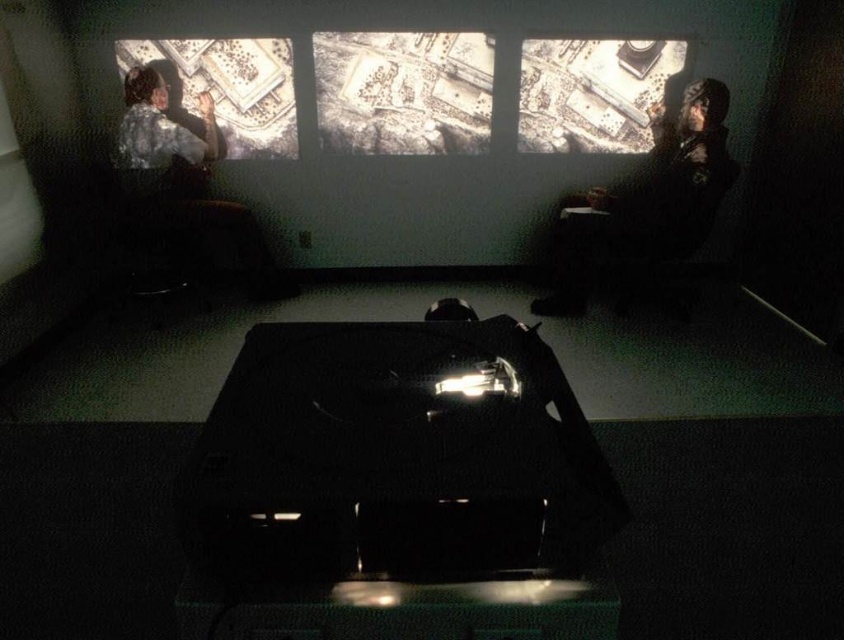
Question: Can you confirm if black glossy projector at center is positioned to the left of matte paper map at upper left?

Choices:
 (A) no
 (B) yes

Answer: (A)

Question: Which is nearer to the dark fabric jacket at right?

Choices:
 (A) matte paper map at upper left
 (B) black glossy projector at center

Answer: (A)

Question: Is dark fabric jacket at right bigger than matte paper map at upper left?

Choices:
 (A) no
 (B) yes

Answer: (B)

Question: Does dark fabric jacket at right have a lesser width compared to matte paper map at upper left?

Choices:
 (A) no
 (B) yes

Answer: (A)

Question: Which point appears farthest from the camera in this image?

Choices:
 (A) click(x=717, y=115)
 (B) click(x=264, y=115)
 (C) click(x=423, y=404)

Answer: (B)

Question: Which object is closer to the camera taking this photo?

Choices:
 (A) matte paper map at upper left
 (B) black glossy projector at center

Answer: (B)